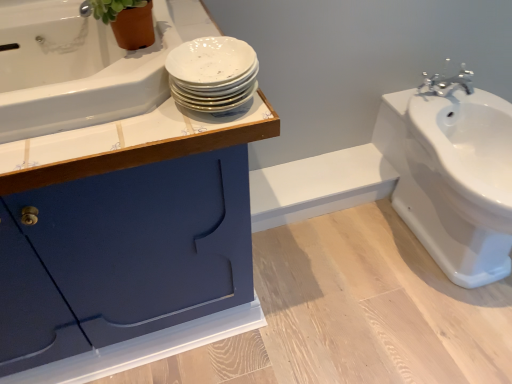
This screenshot has height=384, width=512. I want to click on vacant point to the left of white glossy sink at right, so click(336, 279).